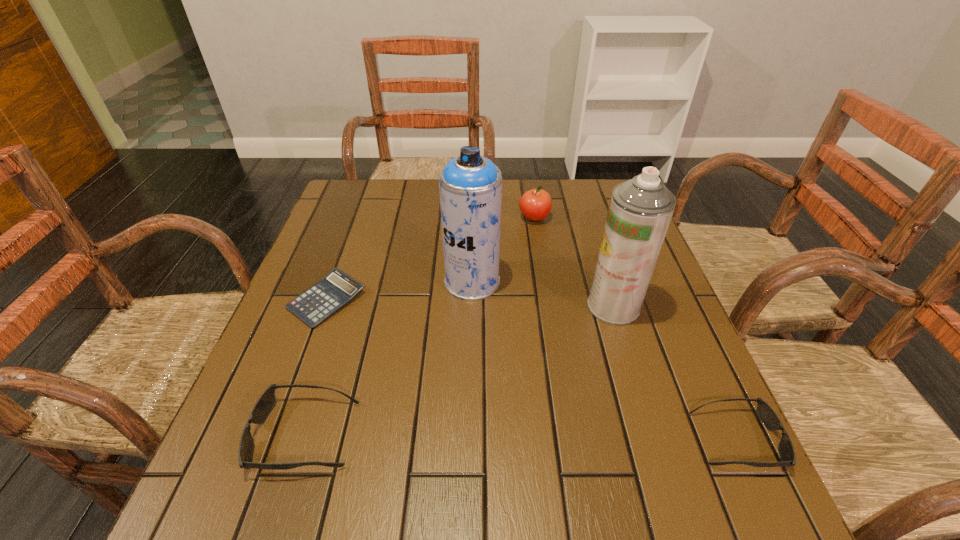
The image size is (960, 540). Find the location of `vacant space that satisfies the following two spatial constraints: 1. on the front side of the third object from right to left; 2. on the right side of the second object from right to left`. vacant space that satisfies the following two spatial constraints: 1. on the front side of the third object from right to left; 2. on the right side of the second object from right to left is located at coordinates (548, 306).